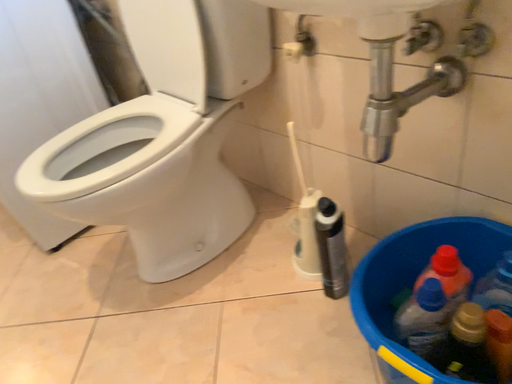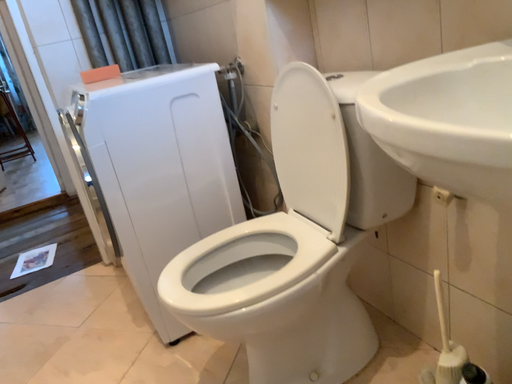
Question: How did the camera likely rotate when shooting the video?

Choices:
 (A) rotated downward
 (B) rotated upward

Answer: (B)